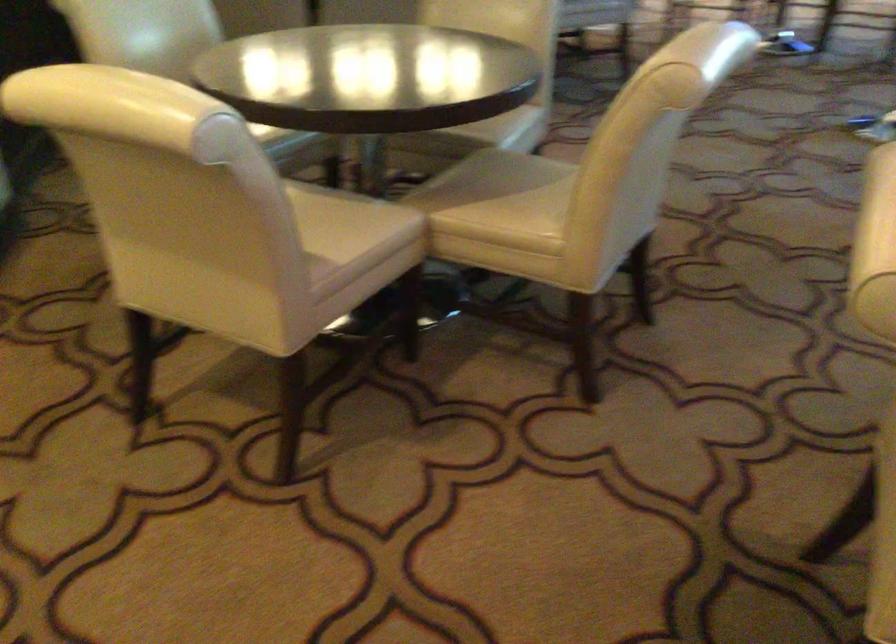
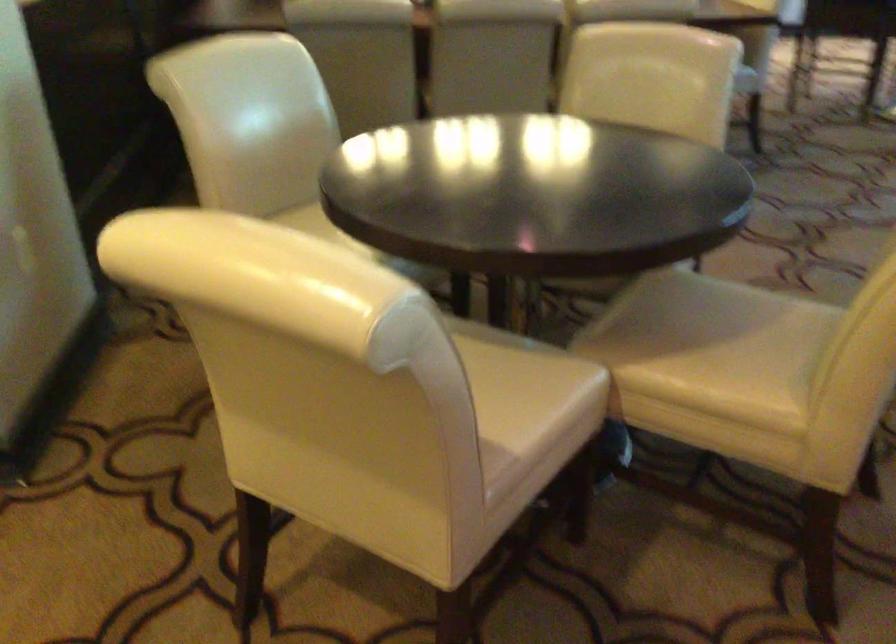
Question: The first image is from the beginning of the video and the second image is from the end. How did the camera likely rotate when shooting the video?

Choices:
 (A) Left
 (B) Right
 (C) Up
 (D) Down

Answer: (A)